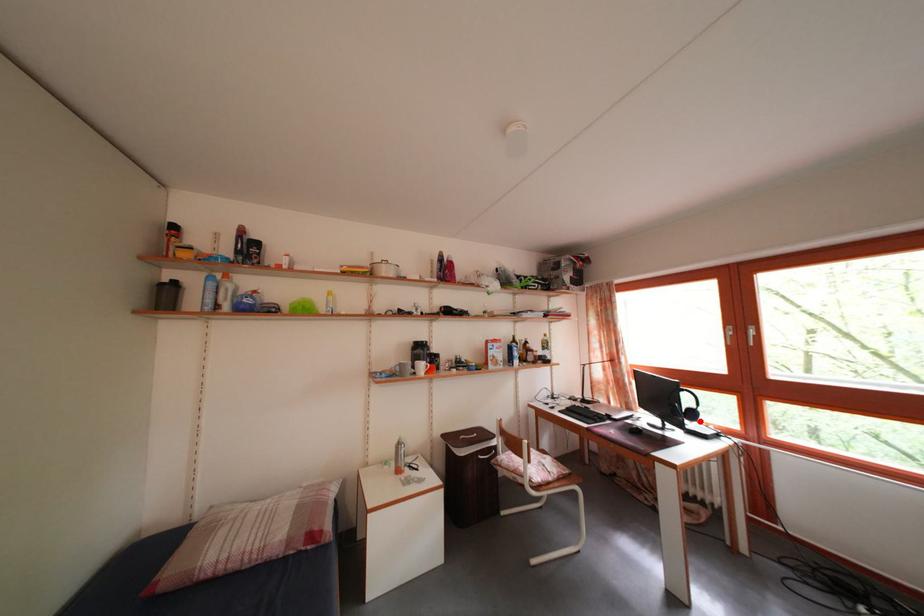
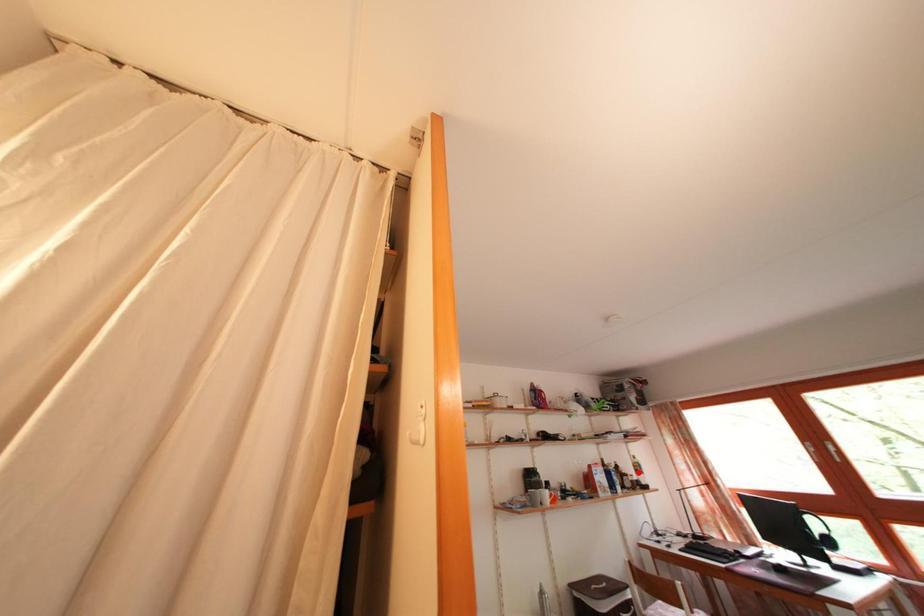
I am providing you with two images of the same scene from different viewpoints. A red point is marked on the first image and another point is marked on the second image. Is the red point in image1 aligned with the point shown in image2?

No